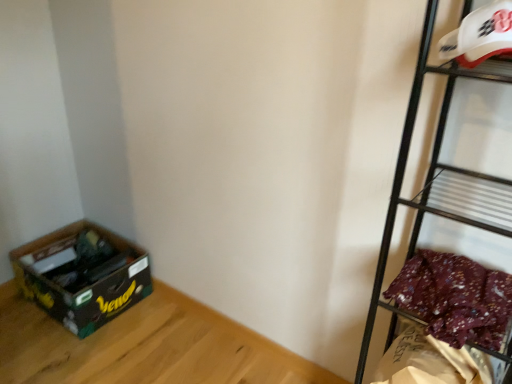
Locate an element on the screen. free point to the right of green cardboard box at lower left is located at coordinates (157, 330).